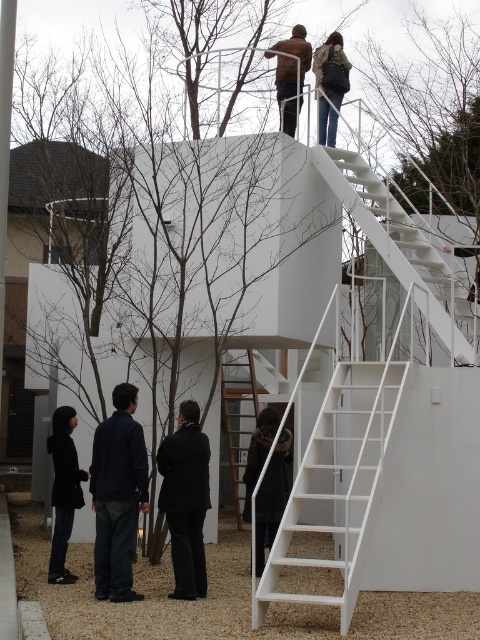
You are a person standing at the base of the building and want to reach the platform at the top. You see a matte black backpack at upper center and a brown leather jacket at upper center. Which item is closer to you as you look up towards the platform?

The matte black backpack at upper center is closer to you since it is in front of the brown leather jacket at upper center.

You are a photographer trying to capture a wide shot of the matte black backpack at upper center and the brown leather jacket at upper center. Since you want both items to appear clearly in the frame, which one should you focus on first to ensure proper focus?

You should focus on the matte black backpack at upper center first because it has a lesser width compared to the brown leather jacket at upper center, making it smaller and potentially harder to capture clearly if not focused on properly.

You are a photographer at the event and need to capture a clear photo of both the black suit at center and the black matte coat at lower left. Which object should you focus on first to ensure both are in focus?

You should focus on the black suit at center first because it is in front of the black matte coat at lower left, so focusing on the closer object will ensure both are in focus.